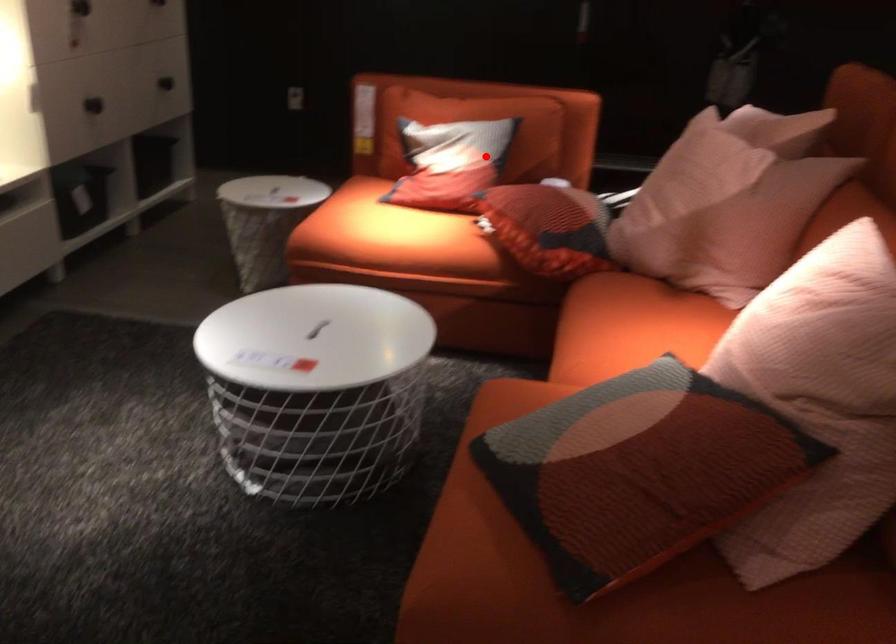
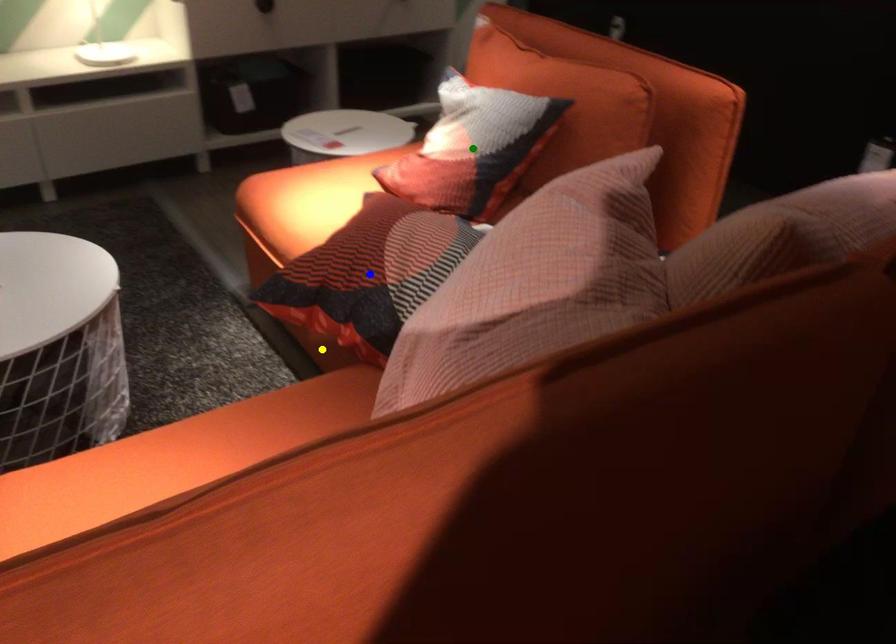
Question: I am providing you with two images of the same scene from different viewpoints. A red point is marked on the first image. You are given multiple points on the second image. Which mark in image 2 goes with the point in image 1?

Choices:
 (A) blue point
 (B) green point
 (C) yellow point

Answer: (B)